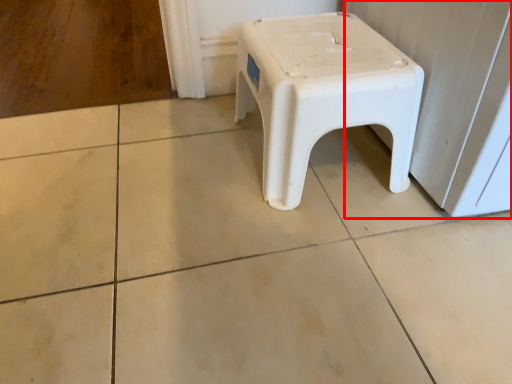
Question: Considering the relative positions of screen door (annotated by the red box) and stool in the image provided, where is screen door (annotated by the red box) located with respect to the staircase?

Choices:
 (A) right
 (B) left

Answer: (A)